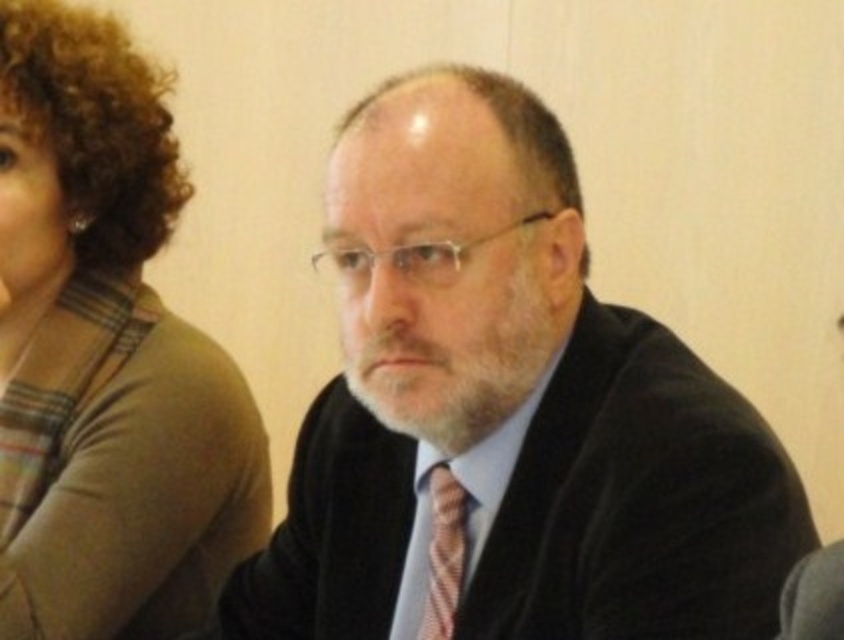
Question: Based on their relative distances, which object is farther from the black velvet suit at center?

Choices:
 (A) pink textured tie at center
 (B) brown plaid shirt at upper left

Answer: (B)

Question: Observing the image, what is the correct spatial positioning of brown plaid shirt at upper left in reference to pink textured tie at center?

Choices:
 (A) above
 (B) below

Answer: (A)

Question: Does black velvet suit at center have a lesser width compared to pink textured tie at center?

Choices:
 (A) no
 (B) yes

Answer: (A)

Question: Based on their relative distances, which object is farther from the black velvet suit at center?

Choices:
 (A) brown plaid shirt at upper left
 (B) pink textured tie at center

Answer: (A)

Question: Which point is closer to the camera?

Choices:
 (A) (52, 512)
 (B) (434, 576)

Answer: (B)

Question: Considering the relative positions of black velvet suit at center and brown plaid shirt at upper left in the image provided, where is black velvet suit at center located with respect to brown plaid shirt at upper left?

Choices:
 (A) left
 (B) right

Answer: (B)